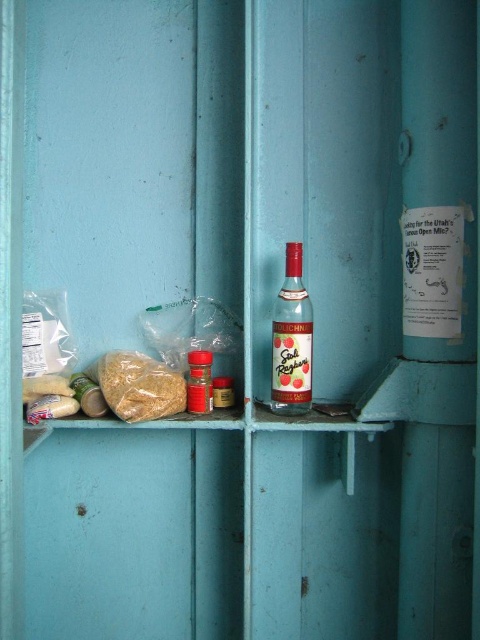
Question: Does matte glass bottle at center have a smaller size compared to brown matte rice at left?

Choices:
 (A) no
 (B) yes

Answer: (B)

Question: Can you confirm if matte glass bottle at center is positioned to the right of brown matte rice at left?

Choices:
 (A) no
 (B) yes

Answer: (B)

Question: Considering the relative positions of matte glass bottle at center and matte plastic container at center in the image provided, where is matte glass bottle at center located with respect to matte plastic container at center?

Choices:
 (A) above
 (B) below

Answer: (A)

Question: Which point appears closest to the camera in this image?

Choices:
 (A) (304, 317)
 (B) (160, 362)

Answer: (A)

Question: Among these points, which one is farthest from the camera?

Choices:
 (A) (193, 408)
 (B) (272, 356)
 (C) (107, 385)

Answer: (B)

Question: Which object is closer to the camera taking this photo?

Choices:
 (A) brown matte rice at left
 (B) matte glass bottle at center

Answer: (A)